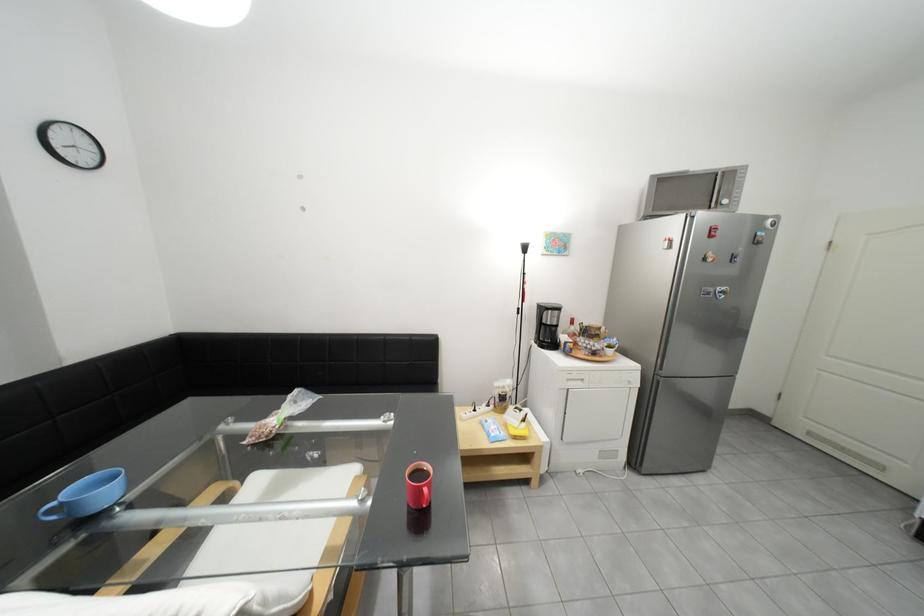
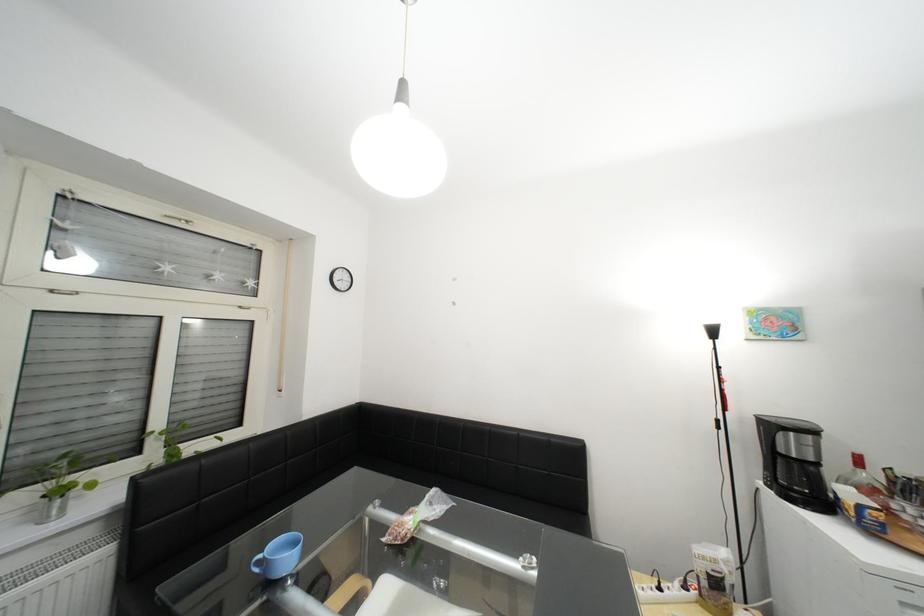
The point at [487,411] is marked in the first image. Where is the corresponding point in the second image?

(672, 590)